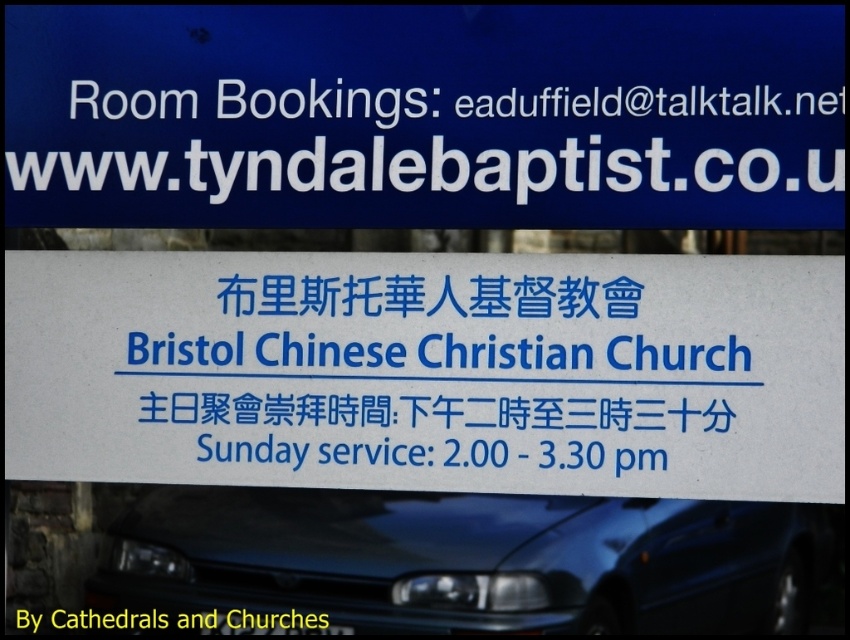
Question: Among these objects, which one is farthest from the camera?

Choices:
 (A) glossy blue car at lower center
 (B) white paper sign at center
 (C) blue plastic sign at upper center

Answer: (C)

Question: Observing the image, what is the correct spatial positioning of white paper sign at center in reference to glossy blue car at lower center?

Choices:
 (A) right
 (B) left

Answer: (B)

Question: Is the position of white paper sign at center more distant than that of glossy blue car at lower center?

Choices:
 (A) no
 (B) yes

Answer: (B)

Question: Which point is closer to the camera?

Choices:
 (A) (370, 508)
 (B) (664, 486)

Answer: (B)

Question: Is white paper sign at center wider than glossy blue car at lower center?

Choices:
 (A) no
 (B) yes

Answer: (B)

Question: Which of the following is the closest to the observer?

Choices:
 (A) glossy blue car at lower center
 (B) white paper sign at center

Answer: (A)